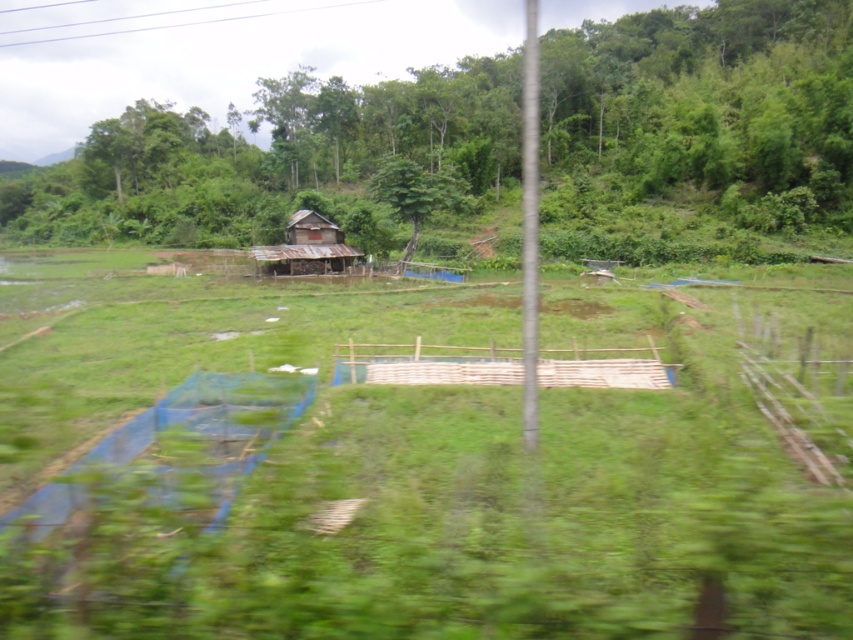
You are planning to set up a small tent in the rural landscape. The tent requires an area wider than the rusty wood hut at center. Can the green grass at center accommodate your tent?

The green grass at center might be wider than the rusty wood hut at center, so it could potentially accommodate the tent if the grass area is indeed wider than the hut.

You are a gardener planning to plant a new row of flowers between the green grass at center and the green leafy tree at center. Given their widths, which object should you place the flowers closer to to ensure they have enough space to grow?

The green grass at center has a lesser width compared to green leafy tree at center, so you should place the flowers closer to the green leafy tree at center to ensure they have enough space to grow.